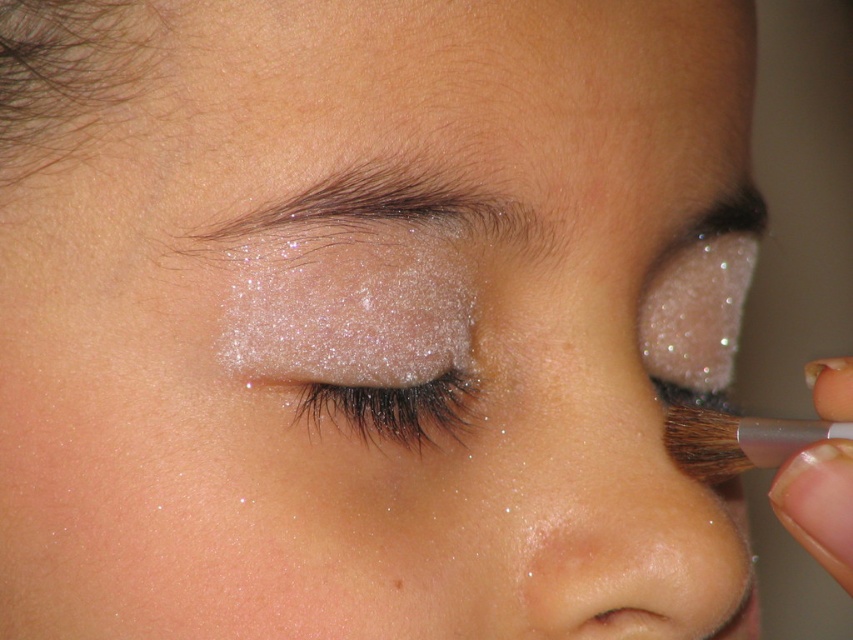
Question: Does slightly shiny dark brown eyebrow at upper center lie in front of shimmering glitter eye at center?

Choices:
 (A) no
 (B) yes

Answer: (B)

Question: Which of these objects is positioned closest to the brown matte freckle at center?

Choices:
 (A) slightly shiny dark brown eyebrow at upper center
 (B) shimmering glitter eye at center

Answer: (B)

Question: Can you confirm if shimmering glitter eye at center is bigger than brown matte freckle at center?

Choices:
 (A) yes
 (B) no

Answer: (A)

Question: Which point appears farthest from the camera in this image?

Choices:
 (A) (355, 428)
 (B) (401, 586)
 (C) (293, 236)

Answer: (A)

Question: Does slightly shiny dark brown eyebrow at upper center have a smaller size compared to shimmering glitter eye at center?

Choices:
 (A) yes
 (B) no

Answer: (B)

Question: Which of the following is the farthest from the observer?

Choices:
 (A) slightly shiny dark brown eyebrow at upper center
 (B) shimmering glitter eye at center
 (C) brown matte freckle at center

Answer: (B)